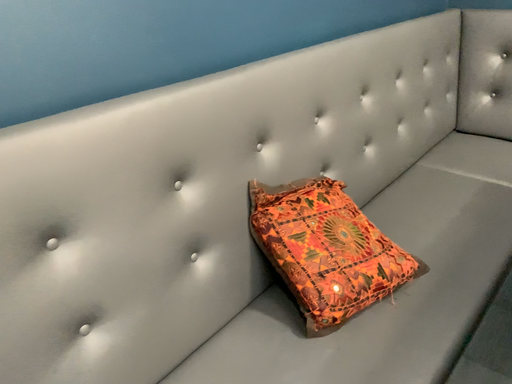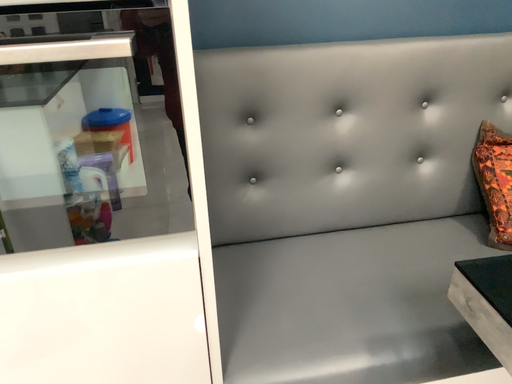
Question: Which way did the camera rotate in the video?

Choices:
 (A) rotated left
 (B) rotated right

Answer: (A)